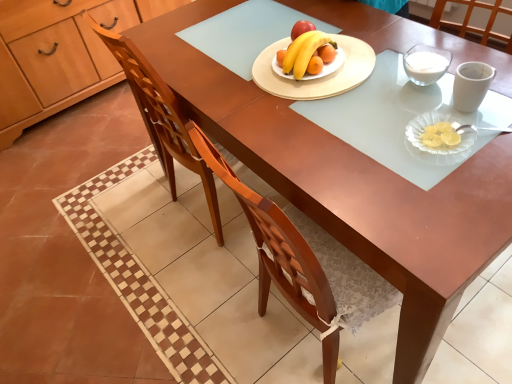
Where is `free space to the left of clear glass platter at lower right, positioned as the 2th platter in top-to-bottom order`? free space to the left of clear glass platter at lower right, positioned as the 2th platter in top-to-bottom order is located at coordinates (368, 154).